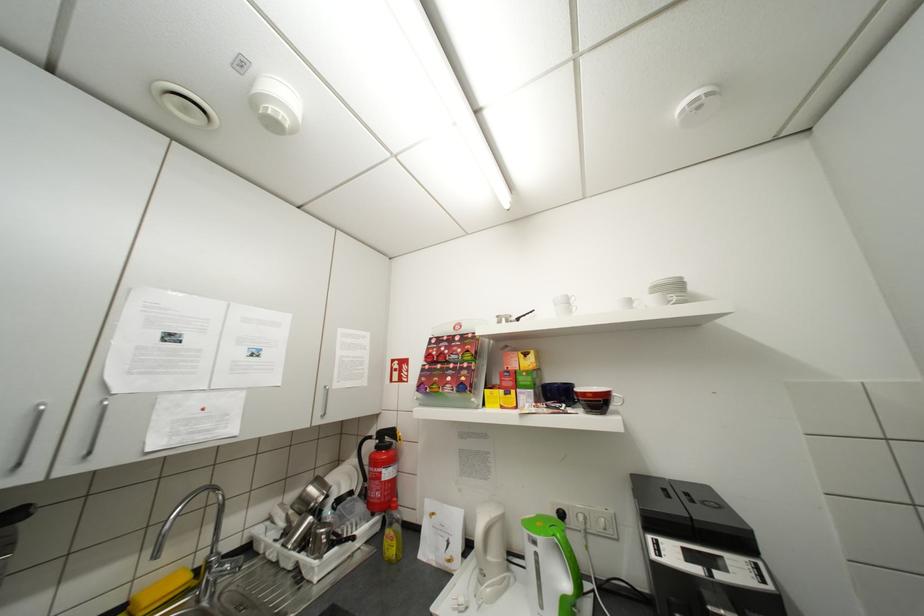
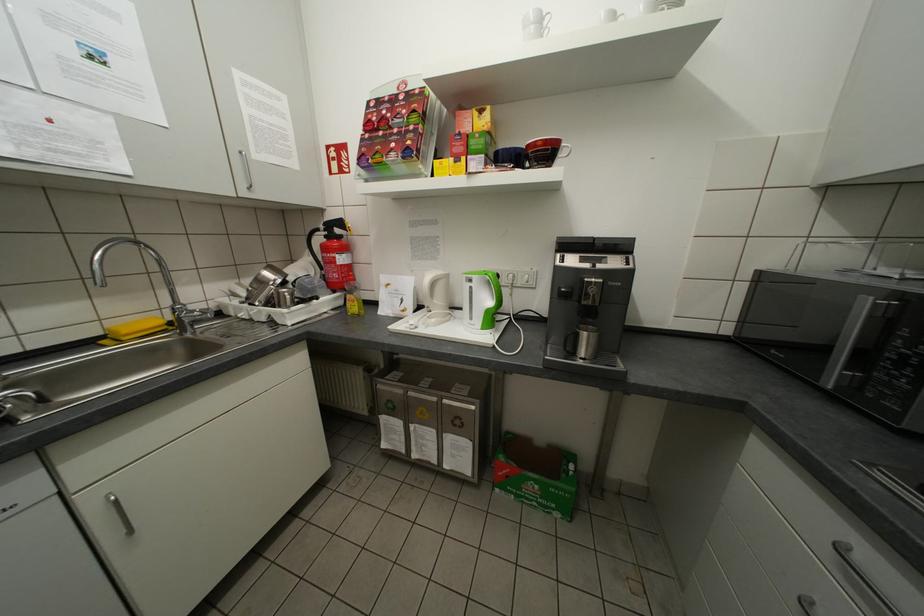
Question: The first image is from the beginning of the video and the second image is from the end. How did the camera likely rotate when shooting the video?

Choices:
 (A) Left
 (B) Right
 (C) Up
 (D) Down

Answer: (D)